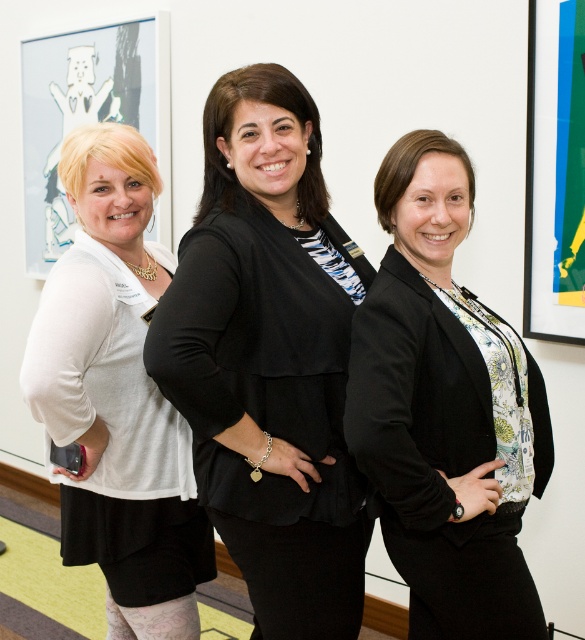
Question: Among these points, which one is nearest to the camera?

Choices:
 (A) (266, 154)
 (B) (493, 547)
 (C) (108, 129)

Answer: (B)

Question: Estimate the real-world distances between objects in this image. Which object is farther from the black matte blazer at center?

Choices:
 (A) white matte shirt at left
 (B) matte black blazer at center

Answer: (A)

Question: Is black matte blazer at center thinner than matte black blazer at center?

Choices:
 (A) yes
 (B) no

Answer: (A)

Question: Estimate the real-world distances between objects in this image. Which object is farther from the matte black blazer at center?

Choices:
 (A) black matte blazer at center
 (B) white matte shirt at left

Answer: (B)

Question: Is black matte blazer at center closer to the viewer compared to matte black blazer at center?

Choices:
 (A) yes
 (B) no

Answer: (B)

Question: Is black matte blazer at center to the right of white matte shirt at left from the viewer's perspective?

Choices:
 (A) no
 (B) yes

Answer: (B)